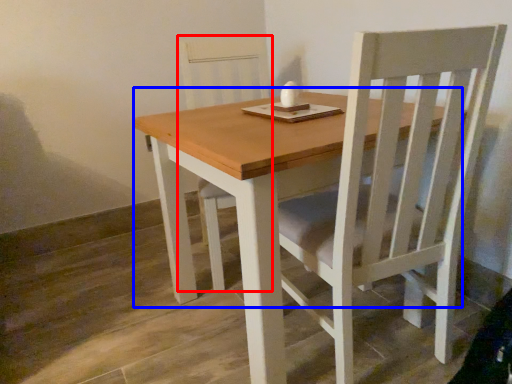
Question: Among these objects, which one is nearest to the camera, chair (highlighted by a red box) or round table (highlighted by a blue box)?

Choices:
 (A) chair
 (B) round table

Answer: (B)